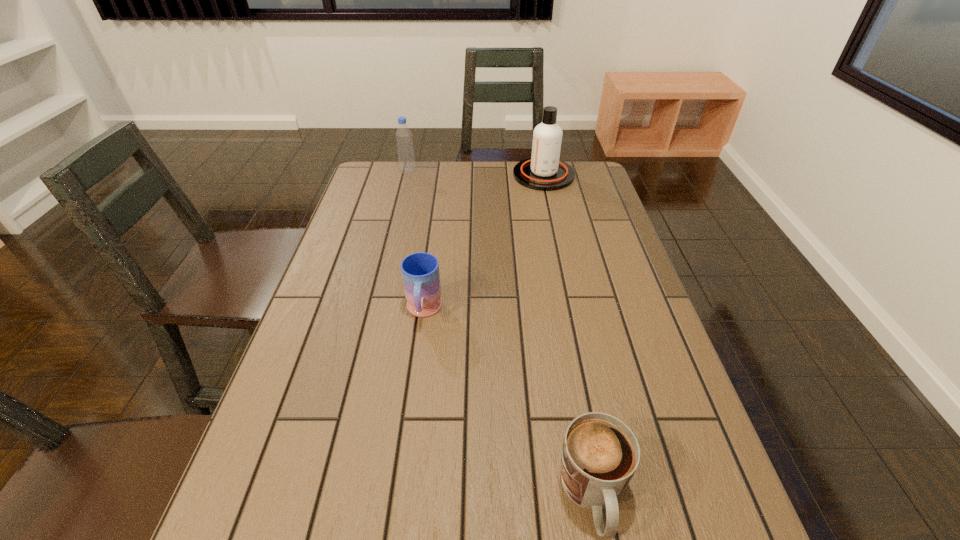
This screenshot has width=960, height=540. What are the coordinates of `cleansing agent` in the screenshot? It's located at (544, 171).

Where is `the leftmost object`? The image size is (960, 540). the leftmost object is located at coordinates (404, 140).

Find the location of a particular element. bottle is located at coordinates (404, 140).

At what (x,y) coordinates should I click in order to perform the action: click on the second nearest object. Please return your answer as a coordinate pair (x, y). This screenshot has height=540, width=960. Looking at the image, I should click on (420, 271).

Locate an element on the screen. the second object from left to right is located at coordinates (420, 271).

Find the location of a particular element. The height and width of the screenshot is (540, 960). vacant space located on the right of the tallest object is located at coordinates (593, 175).

This screenshot has height=540, width=960. What are the coordinates of `vacant space located 0.390m on the front of the bottle` in the screenshot? It's located at tap(391, 241).

Identify the location of vacant space located on the side of the third farthest object with the handle. (399, 500).

Find the location of a particular element. This screenshot has width=960, height=540. cleansing agent that is at the far edge is located at coordinates (544, 171).

The image size is (960, 540). I want to click on bottle located in the far edge section of the desktop, so click(404, 140).